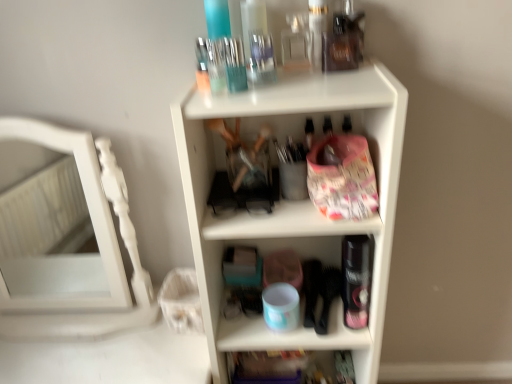
Question: From a real-world perspective, does translucent plastic container at lower center, the second shelf when ordered from top to bottom, sit lower than white plastic shelf at center, which is counted as the second shelf, starting from the bottom?

Choices:
 (A) no
 (B) yes

Answer: (B)

Question: Is translucent plastic container at lower center, positioned as the 1th shelf in bottom-to-top order, at the left side of white plastic shelf at center, which is counted as the second shelf, starting from the bottom?

Choices:
 (A) no
 (B) yes

Answer: (B)

Question: Is translucent plastic container at lower center, the second shelf when ordered from top to bottom, positioned before white plastic shelf at center, which is counted as the second shelf, starting from the bottom?

Choices:
 (A) yes
 (B) no

Answer: (B)

Question: Considering the relative sizes of translucent plastic container at lower center, the second shelf when ordered from top to bottom, and white plastic shelf at center, which is counted as the second shelf, starting from the bottom, in the image provided, is translucent plastic container at lower center, the second shelf when ordered from top to bottom, thinner than white plastic shelf at center, which is counted as the second shelf, starting from the bottom,?

Choices:
 (A) yes
 (B) no

Answer: (A)

Question: From the image's perspective, is translucent plastic container at lower center, positioned as the 1th shelf in bottom-to-top order, located beneath white plastic shelf at center, the first shelf from the top?

Choices:
 (A) yes
 (B) no

Answer: (A)

Question: Considering the positions of translucent plastic container at lower center, positioned as the 1th shelf in bottom-to-top order, and white plastic shelf at center, the first shelf from the top, in the image, is translucent plastic container at lower center, positioned as the 1th shelf in bottom-to-top order, wider or thinner than white plastic shelf at center, the first shelf from the top,?

Choices:
 (A) wide
 (B) thin

Answer: (B)

Question: Does point (238, 360) appear closer or farther from the camera than point (365, 365)?

Choices:
 (A) farther
 (B) closer

Answer: (A)

Question: From the image's perspective, is translucent plastic container at lower center, the second shelf when ordered from top to bottom, positioned above or below white plastic shelf at center, which is counted as the second shelf, starting from the bottom?

Choices:
 (A) above
 (B) below

Answer: (B)

Question: Considering the positions of translucent plastic container at lower center, the second shelf when ordered from top to bottom, and white plastic shelf at center, which is counted as the second shelf, starting from the bottom, in the image, is translucent plastic container at lower center, the second shelf when ordered from top to bottom, taller or shorter than white plastic shelf at center, which is counted as the second shelf, starting from the bottom,?

Choices:
 (A) short
 (B) tall

Answer: (A)

Question: Is white wooden mirror at left inside the boundaries of translucent plastic container at lower center, the second shelf when ordered from top to bottom, or outside?

Choices:
 (A) inside
 (B) outside

Answer: (B)

Question: Considering the relative positions of white wooden mirror at left and translucent plastic container at lower center, the second shelf when ordered from top to bottom, in the image provided, is white wooden mirror at left to the left or to the right of translucent plastic container at lower center, the second shelf when ordered from top to bottom,?

Choices:
 (A) right
 (B) left

Answer: (B)

Question: From the image's perspective, is white wooden mirror at left positioned above or below translucent plastic container at lower center, positioned as the 1th shelf in bottom-to-top order?

Choices:
 (A) above
 (B) below

Answer: (A)

Question: In the image, is white wooden mirror at left positioned in front of or behind translucent plastic container at lower center, positioned as the 1th shelf in bottom-to-top order?

Choices:
 (A) front
 (B) behind

Answer: (A)

Question: From the image's perspective, is white plastic shelf at center, which is counted as the second shelf, starting from the bottom, positioned above or below translucent plastic container at lower center, the second shelf when ordered from top to bottom?

Choices:
 (A) above
 (B) below

Answer: (A)

Question: Is white plastic shelf at center, the first shelf from the top, inside or outside of translucent plastic container at lower center, positioned as the 1th shelf in bottom-to-top order?

Choices:
 (A) inside
 (B) outside

Answer: (B)